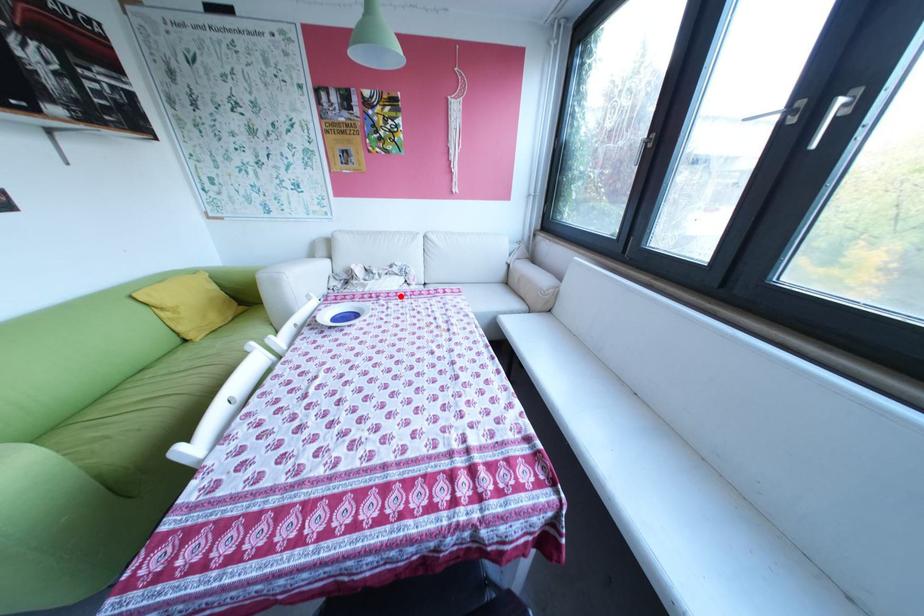
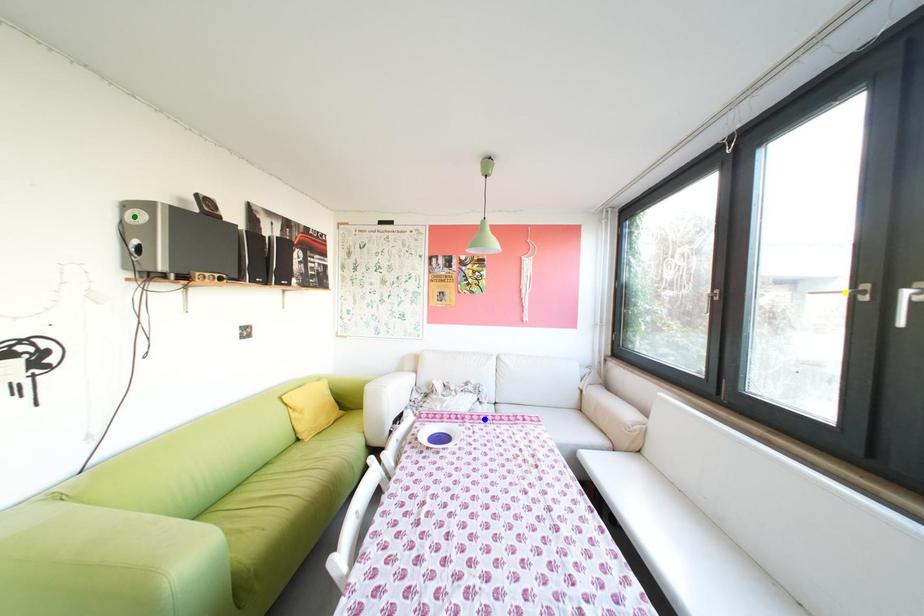
Question: I am providing you with two images of the same scene from different viewpoints. A red point is marked on the first image. You are given multiple points on the second image. Which point in image 2 is actually the same real-world point as the red point in image 1?

Choices:
 (A) yellow point
 (B) green point
 (C) blue point

Answer: (C)